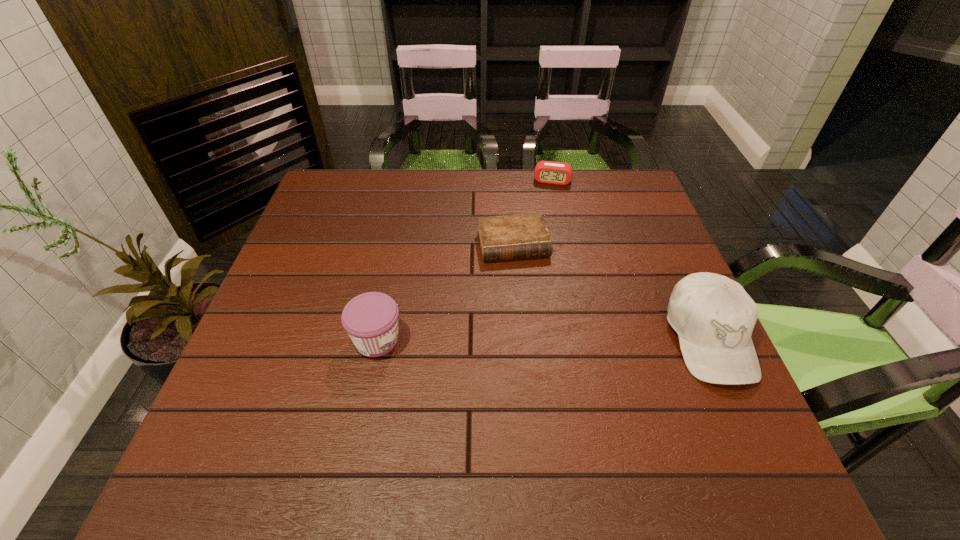
Where is `vacant space in between the leftmost object and the third tallest object`? This screenshot has height=540, width=960. vacant space in between the leftmost object and the third tallest object is located at coordinates (465, 260).

The height and width of the screenshot is (540, 960). What are the coordinates of `vacant space in between the tallest object and the third nearest object` in the screenshot? It's located at (611, 292).

Find the location of `vacant point located between the tallest object and the third nearest object`. vacant point located between the tallest object and the third nearest object is located at coordinates (611, 292).

Find the location of a particular element. This screenshot has width=960, height=540. empty space between the rightmost object and the shortest object is located at coordinates (611, 292).

At what (x,y) coordinates should I click in order to perform the action: click on vacant space that's between the third nearest object and the second tallest object. Please return your answer as a coordinate pair (x, y). Looking at the image, I should click on (445, 292).

Where is `free space between the leftmost object and the second shortest object`? Image resolution: width=960 pixels, height=540 pixels. free space between the leftmost object and the second shortest object is located at coordinates (465, 260).

Identify which object is the closest to the rightmost object. Please provide its 2D coordinates. Your answer should be formatted as a tuple, i.e. [(x, y)], where the tuple contains the x and y coordinates of a point satisfying the conditions above.

[(518, 236)]

Point out which object is positioned as the third nearest to the farthest object. Please provide its 2D coordinates. Your answer should be formatted as a tuple, i.e. [(x, y)], where the tuple contains the x and y coordinates of a point satisfying the conditions above.

[(371, 319)]